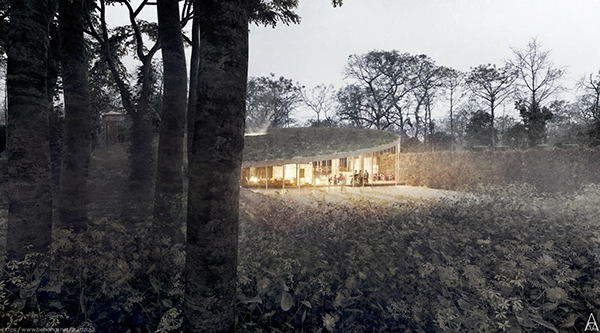
Locate an element on the screen. The height and width of the screenshot is (333, 600). furniture is located at coordinates (273, 185), (288, 182).